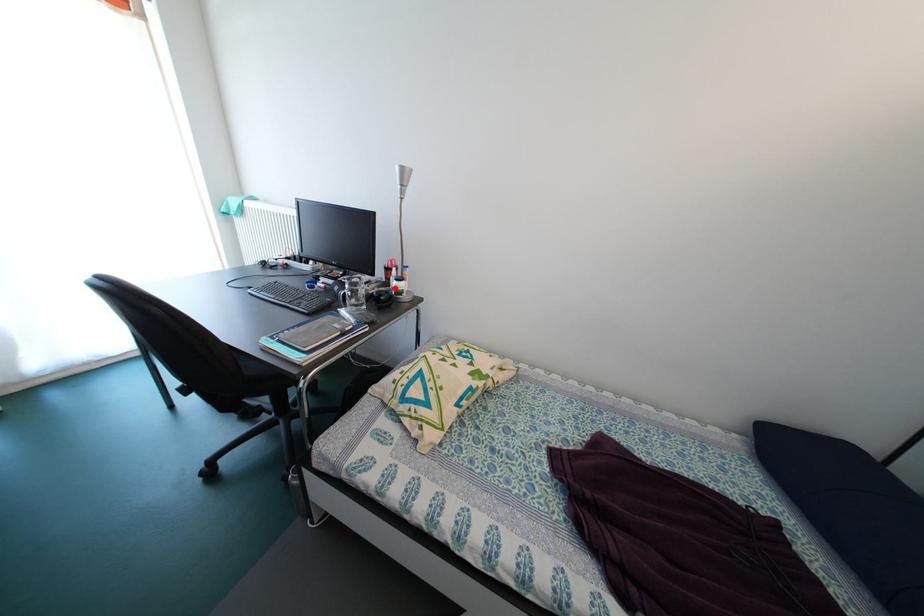
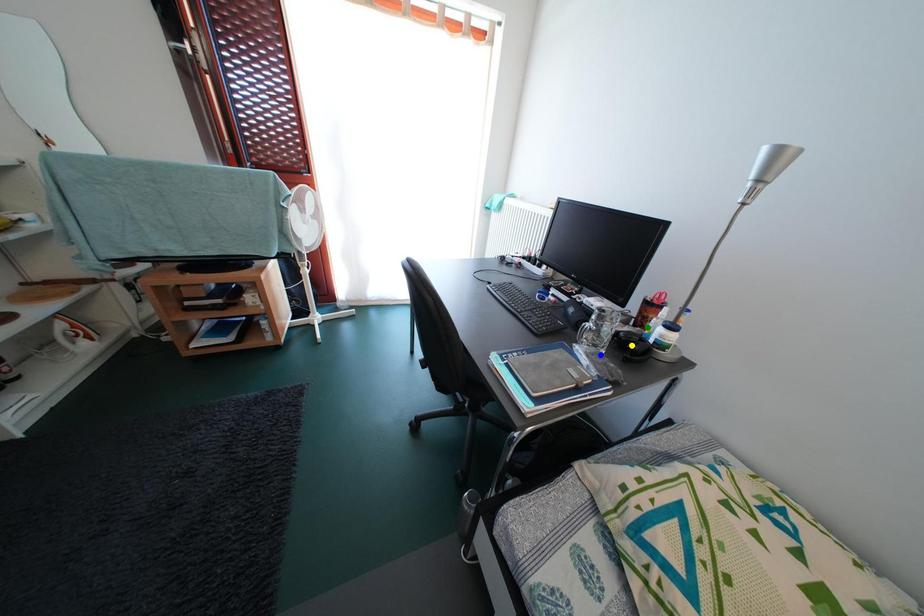
Question: I am providing you with two images of the same scene from different viewpoints. A red point is marked on the first image. You are given multiple points on the second image. Which point in image 2 represents the same 3d spot as the red point in image 1?

Choices:
 (A) green point
 (B) yellow point
 (C) blue point

Answer: (A)